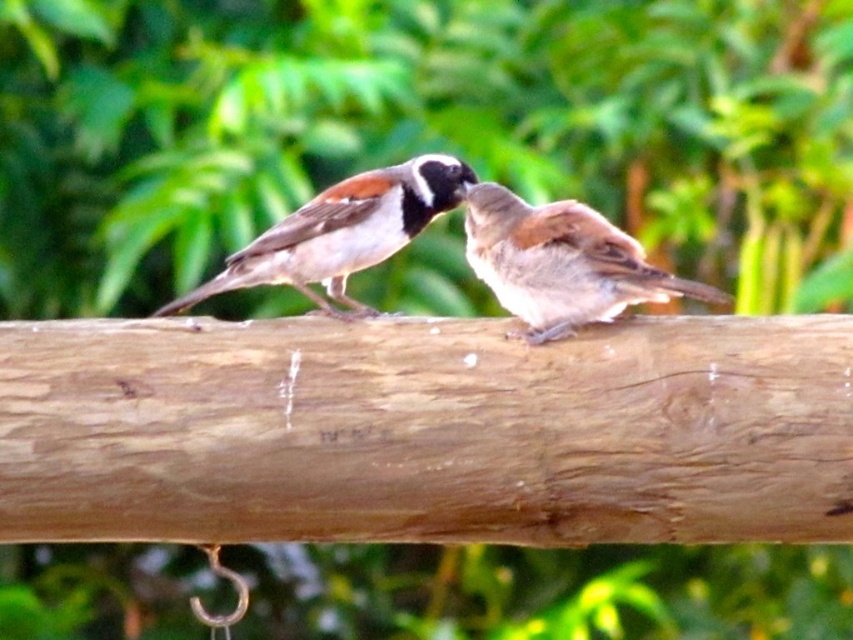
You are a birdwatcher observing two birds on a wooden surface. You notice the brown wood log at center and the brown speckled feathers at center. Which object is positioned lower in the image?

The brown wood log at center is located below brown speckled feathers at center, so the brown wood log at center is positioned lower in the image.

You are a birdwatcher trying to identify the exact location of a brown feathered sparrow. You have a map with coordinates. According to the map, there is a point at coordinates (561, 262). Where is this point located?

The point at coordinates (561, 262) is located on the brown feathered sparrow at center.

You are a birdwatcher trying to photograph two birds perched on the brown wood log at center. If you want to focus your camera on the exact center of the log, what coordinates should you aim for?

The brown wood log at center is located at point (426, 432), so you should aim your camera at those coordinates to focus on the exact center of the log.